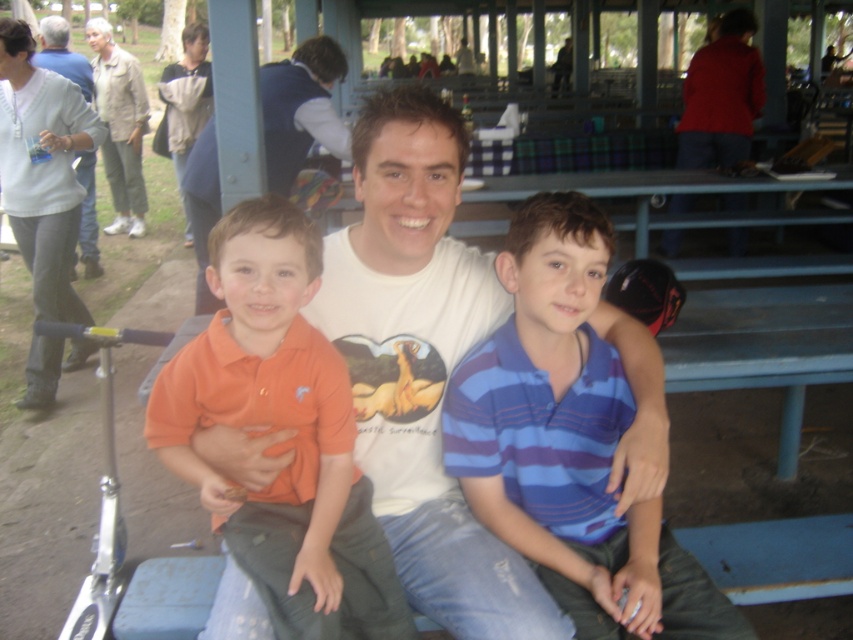
Does beige fabric jacket at upper left have a greater height compared to light gray sweater at upper left?

Correct, beige fabric jacket at upper left is much taller as light gray sweater at upper left.

Does beige fabric jacket at upper left come in front of light gray sweater at upper left?

No, it is behind light gray sweater at upper left.

Which is behind, point (137, 108) or point (59, 60)?

Positioned behind is point (137, 108).

What are the coordinates of `beige fabric jacket at upper left` in the screenshot? It's located at (119, 125).

Is orange cotton shirt at center to the left of beige fabric jacket at upper left from the viewer's perspective?

Incorrect, orange cotton shirt at center is not on the left side of beige fabric jacket at upper left.

Between orange cotton shirt at center and beige fabric jacket at upper left, which one is positioned lower?

orange cotton shirt at center is lower down.

I want to click on orange cotton shirt at center, so click(282, 426).

Where is `orange cotton shirt at center`? orange cotton shirt at center is located at coordinates (282, 426).

Which is behind, point (602, 262) or point (91, 76)?

Point (91, 76)

Is blue striped shirt at center above light gray sweater at upper left?

No, blue striped shirt at center is not above light gray sweater at upper left.

This screenshot has width=853, height=640. What are the coordinates of `blue striped shirt at center` in the screenshot? It's located at (567, 442).